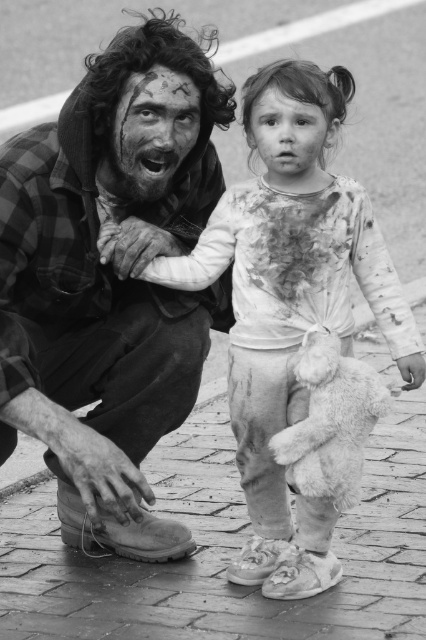
You are standing in front of the photograph and want to know which of the two points, point (46, 419) or point (290, 163), is closer to you. Can you determine this based on the image?

Point (46, 419) is closer to you than point (290, 163) because it is further to the viewer in the image.

Based on the scene described, which object is positioned closer to the viewer between the dirty plaid shirt at left and the fluffy white teddy bear at lower center?

The dirty plaid shirt at left is closer to the viewer because the fluffy white teddy bear at lower center is described as being behind it.